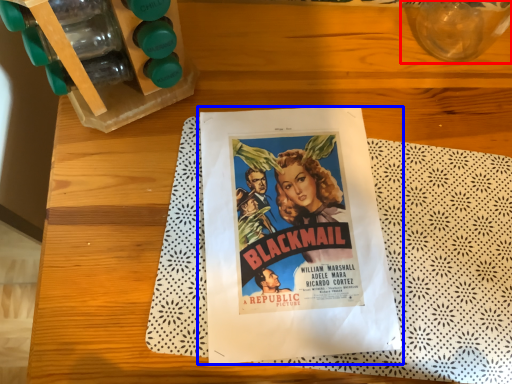
Question: Which object appears farthest to the camera in this image, glass vase (highlighted by a red box) or paperback book (highlighted by a blue box)?

Choices:
 (A) glass vase
 (B) paperback book

Answer: (B)